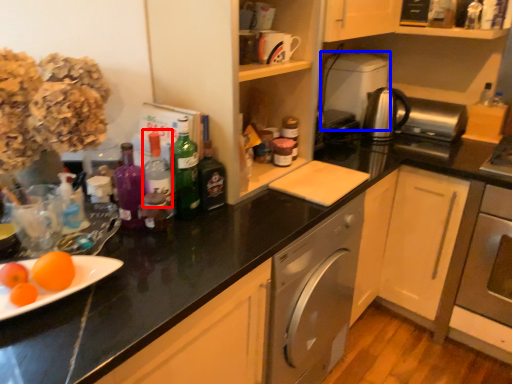
Question: Which point is closer to the camera, bottle (highlighted by a red box) or appliance (highlighted by a blue box)?

Choices:
 (A) bottle
 (B) appliance

Answer: (A)